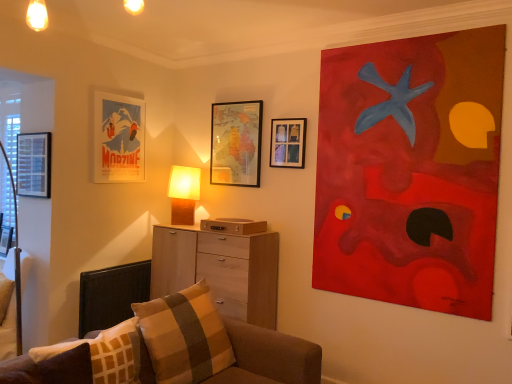
Question: Considering the relative sizes of matte wooden picture frame at upper center, the 2th picture frame in the right-to-left sequence, and brown plaid pillow at lower left, which is the second pillow from back to front, in the image provided, is matte wooden picture frame at upper center, the 2th picture frame in the right-to-left sequence, bigger than brown plaid pillow at lower left, which is the second pillow from back to front,?

Choices:
 (A) no
 (B) yes

Answer: (A)

Question: From the image's perspective, is matte wooden picture frame at upper center, acting as the 5th picture frame starting from the left, beneath brown plaid pillow at lower left, arranged as the 1th pillow when viewed from the front?

Choices:
 (A) yes
 (B) no

Answer: (B)

Question: From a real-world perspective, is matte wooden picture frame at upper center, acting as the 5th picture frame starting from the left, physically below brown plaid pillow at lower left, arranged as the 1th pillow when viewed from the front?

Choices:
 (A) no
 (B) yes

Answer: (A)

Question: From a real-world perspective, is matte wooden picture frame at upper center, the 2th picture frame in the right-to-left sequence, over brown plaid pillow at lower left, which is the second pillow from back to front?

Choices:
 (A) no
 (B) yes

Answer: (B)

Question: Is there a large distance between matte wooden picture frame at upper center, acting as the 5th picture frame starting from the left, and brown plaid pillow at lower left, which is the second pillow from back to front?

Choices:
 (A) no
 (B) yes

Answer: (B)

Question: Is light wood chest of drawers at center situated inside matte wooden picture frame at upper center, acting as the 5th picture frame starting from the left, or outside?

Choices:
 (A) inside
 (B) outside

Answer: (B)

Question: From the image's perspective, is light wood chest of drawers at center positioned above or below matte wooden picture frame at upper center, the 2th picture frame in the right-to-left sequence?

Choices:
 (A) above
 (B) below

Answer: (B)

Question: Is light wood chest of drawers at center wider or thinner than matte wooden picture frame at upper center, the 2th picture frame in the right-to-left sequence?

Choices:
 (A) thin
 (B) wide

Answer: (B)

Question: From a real-world perspective, is light wood chest of drawers at center above or below matte wooden picture frame at upper center, the 2th picture frame in the right-to-left sequence?

Choices:
 (A) below
 (B) above

Answer: (A)

Question: From a real-world perspective, is brown fabric couch at lower right physically located above or below matte black picture frame at left, the 5th picture frame when ordered from right to left?

Choices:
 (A) above
 (B) below

Answer: (B)

Question: Does point (33, 354) appear closer or farther from the camera than point (35, 168)?

Choices:
 (A) farther
 (B) closer

Answer: (B)

Question: Considering their positions, is brown fabric couch at lower right located in front of or behind matte black picture frame at left, the 5th picture frame when ordered from right to left?

Choices:
 (A) behind
 (B) front

Answer: (B)

Question: Would you say brown fabric couch at lower right is to the left or to the right of matte black picture frame at left, the 5th picture frame when ordered from right to left, in the picture?

Choices:
 (A) right
 (B) left

Answer: (A)

Question: Would you say matte paper poster at upper left, arranged as the fourth picture frame when viewed from the right, is to the left or to the right of black fabric swivel chair at lower left in the picture?

Choices:
 (A) left
 (B) right

Answer: (B)

Question: From their relative heights in the image, would you say matte paper poster at upper left, arranged as the fourth picture frame when viewed from the right, is taller or shorter than black fabric swivel chair at lower left?

Choices:
 (A) short
 (B) tall

Answer: (B)